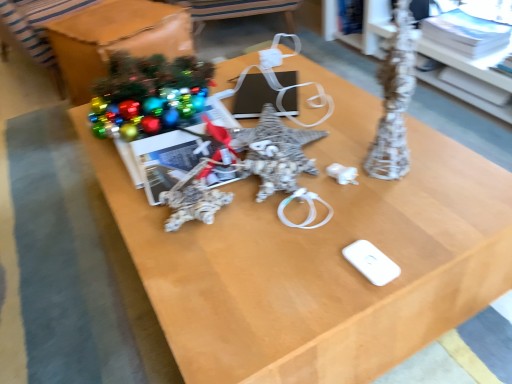
Identify the location of free location to the right of white matte ipod at lower right. (430, 236).